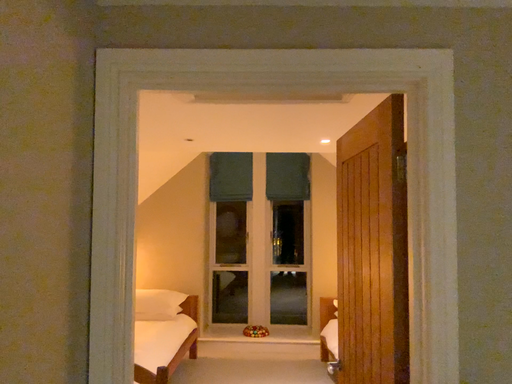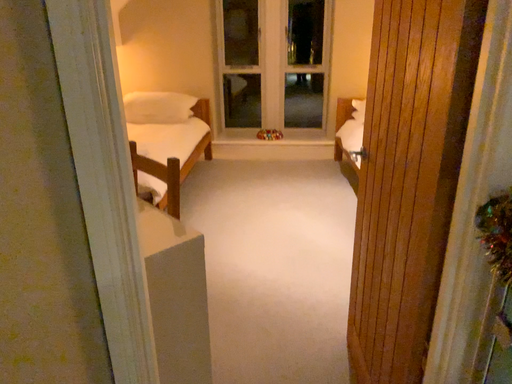
Question: Which way did the camera rotate in the video?

Choices:
 (A) rotated upward
 (B) rotated downward

Answer: (B)